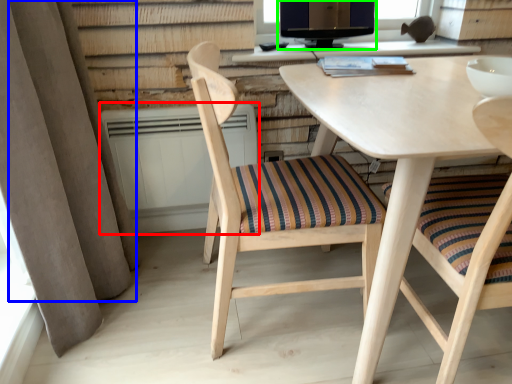
Question: Considering the real-world distances, which object is closest to radiator (highlighted by a red box)? curtain (highlighted by a blue box) or computer monitor (highlighted by a green box).

Choices:
 (A) curtain
 (B) computer monitor

Answer: (A)